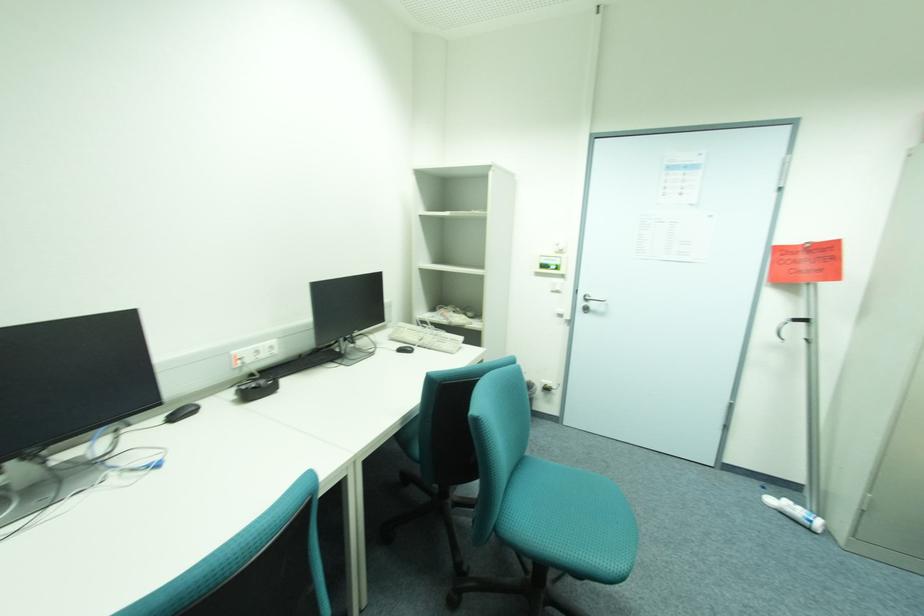
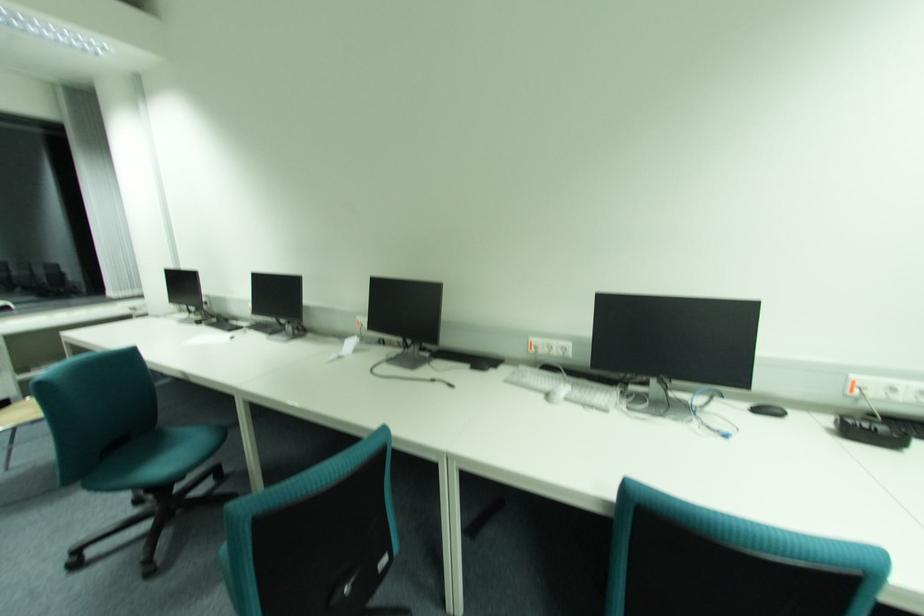
Question: The first image is from the beginning of the video and the second image is from the end. How did the camera likely rotate when shooting the video?

Choices:
 (A) Left
 (B) Right
 (C) Up
 (D) Down

Answer: (A)